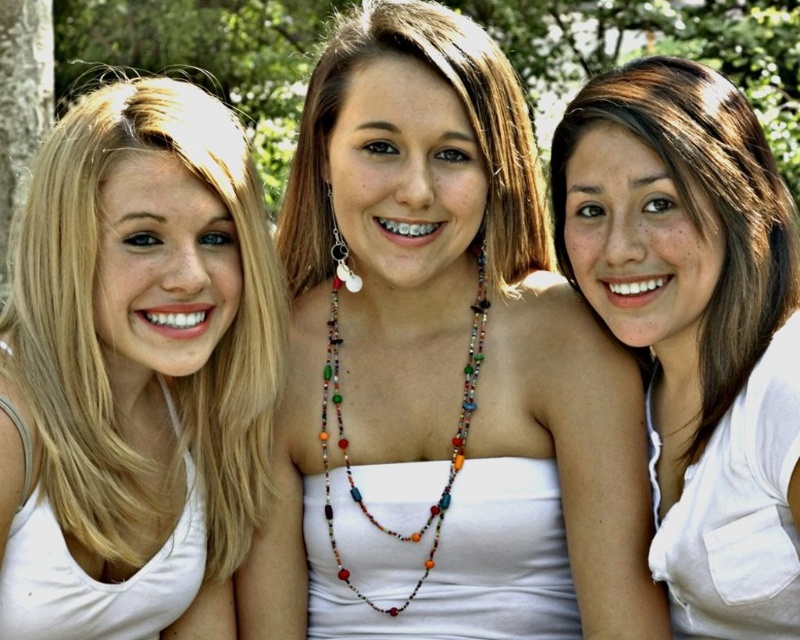
You are a photographer trying to capture the white matte tank top at center and the green leafy tree at upper center in a single frame. Based on their sizes in the image, which object would appear more prominent in the photo?

The white matte tank top at center appears more prominent in the photo because it is larger in size than the green leafy tree at upper center.

Based on the scene description, can you determine if the white matte tank top at center is positioned above or below the green leafy tree at upper center?

The white matte tank top at center is located below the green leafy tree at upper center.

You are a photographer trying to focus on the white matte tank top at center in this image. The camera is currently focused on the point at coordinates point (440,371). Is the focus point correctly positioned to capture the white matte tank top at center?

Yes, the focus point at point (440,371) is correctly positioned to capture the white matte tank top at center because the description states that the point indicates the white matte tank top at center.